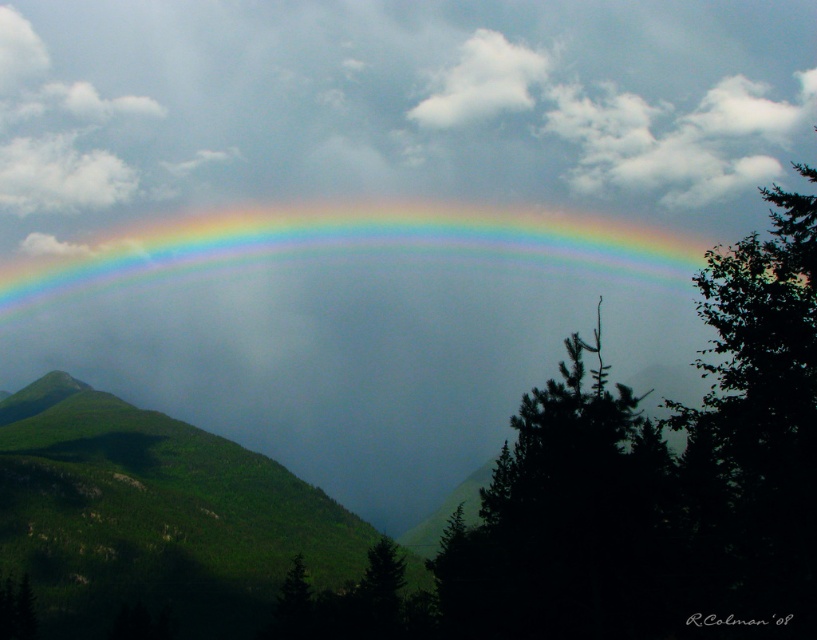
You are standing at point (154,516) in the image. Based on the scene description, what would you see directly in front of you?

At point (154,516) lies green grassy hillside at lower left, so you would see the green grassy hillside at lower left directly in front of you.

You are an observer looking at the rainbow and the landscape. Which object is located below the other between the green matte tree at center and the white fluffy cloud at upper center?

The green matte tree at center is positioned under the white fluffy cloud at upper center.

From the picture: You are an artist trying to paint the scene. You notice the green matte tree at center and the white fluffy cloud at upper center. Which object should you draw first if you want to paint the smaller one before the larger one?

You should draw the green matte tree at center first because it is smaller than the white fluffy cloud at upper center.